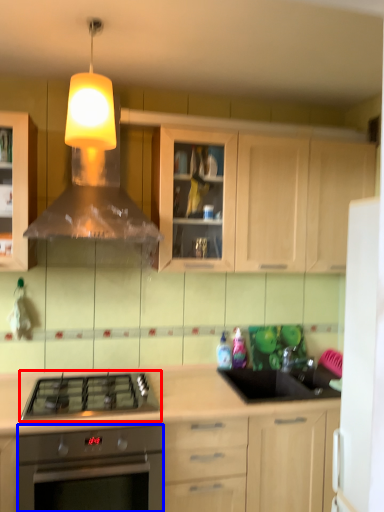
Question: Among these objects, which one is farthest to the camera, gas stove (highlighted by a red box) or oven (highlighted by a blue box)?

Choices:
 (A) gas stove
 (B) oven

Answer: (A)